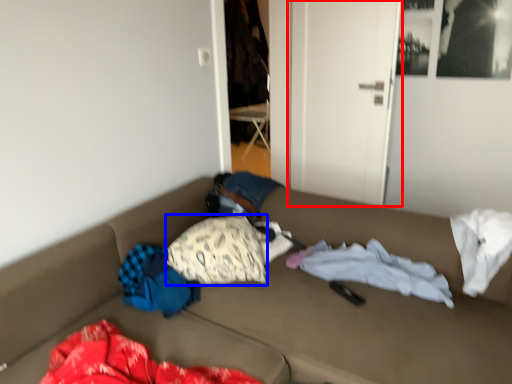
Question: Which object is closer to the camera taking this photo, door (highlighted by a red box) or pillow (highlighted by a blue box)?

Choices:
 (A) door
 (B) pillow

Answer: (B)